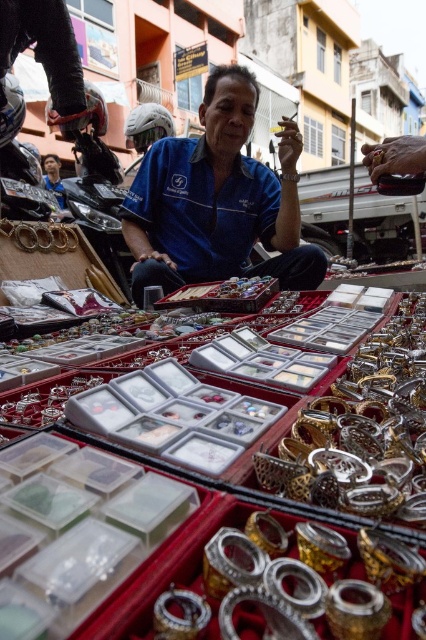
Question: Is blue fabric shirt at center to the right of gold metallic rings at center from the viewer's perspective?

Choices:
 (A) yes
 (B) no

Answer: (B)

Question: Estimate the real-world distances between objects in this image. Which object is farther from the gold metallic bracelet at center?

Choices:
 (A) blue fabric shirt at center
 (B) gold metallic bangles at center

Answer: (B)

Question: Is gold metallic bangles at center smaller than gold metallic bracelet at center?

Choices:
 (A) yes
 (B) no

Answer: (B)

Question: Can you confirm if gold metallic rings at center is bigger than gold metallic bracelet at center?

Choices:
 (A) yes
 (B) no

Answer: (A)

Question: Which of the following is the closest to the observer?

Choices:
 (A) (20, 243)
 (B) (232, 96)
 (C) (351, 378)

Answer: (C)

Question: Estimate the real-world distances between objects in this image. Which object is farther from the gold metallic bracelet at center?

Choices:
 (A) gold metallic rings at center
 (B) blue fabric shirt at center
 (C) gold metallic bangles at center

Answer: (A)